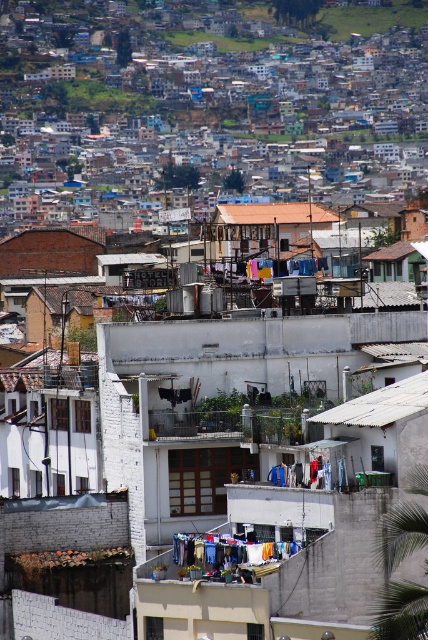
Who is positioned more to the right, blue fabric laundry at center or brown tile roof at center?

brown tile roof at center is more to the right.

Is blue fabric laundry at center shorter than brown tile roof at center?

Yes.

Is point (249, 554) closer to viewer compared to point (246, 209)?

Yes, point (249, 554) is closer to viewer.

Locate an element on the screen. The image size is (428, 640). blue fabric laundry at center is located at coordinates (226, 550).

Between point (309, 419) and point (279, 216), which one is positioned in front?

Point (309, 419) is in front.

From the picture: Does white corrugated metal roof at center have a larger size compared to brown tile roof at center?

No.

The height and width of the screenshot is (640, 428). Find the location of `white corrugated metal roof at center`. white corrugated metal roof at center is located at coordinates (380, 404).

Is white corrugated metal roof at center above blue fabric laundry at center?

Correct, white corrugated metal roof at center is located above blue fabric laundry at center.

From the picture: Can you confirm if white corrugated metal roof at center is bigger than blue fabric laundry at center?

Correct, white corrugated metal roof at center is larger in size than blue fabric laundry at center.

Between point (336, 420) and point (214, 552), which one is positioned in front?

Positioned in front is point (214, 552).

Where is `white corrugated metal roof at center`? The height and width of the screenshot is (640, 428). white corrugated metal roof at center is located at coordinates (380, 404).